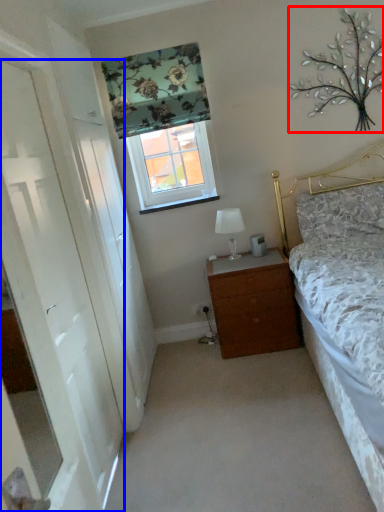
Question: Which of the following is the closest to the observer, tree (highlighted by a red box) or door (highlighted by a blue box)?

Choices:
 (A) tree
 (B) door

Answer: (B)